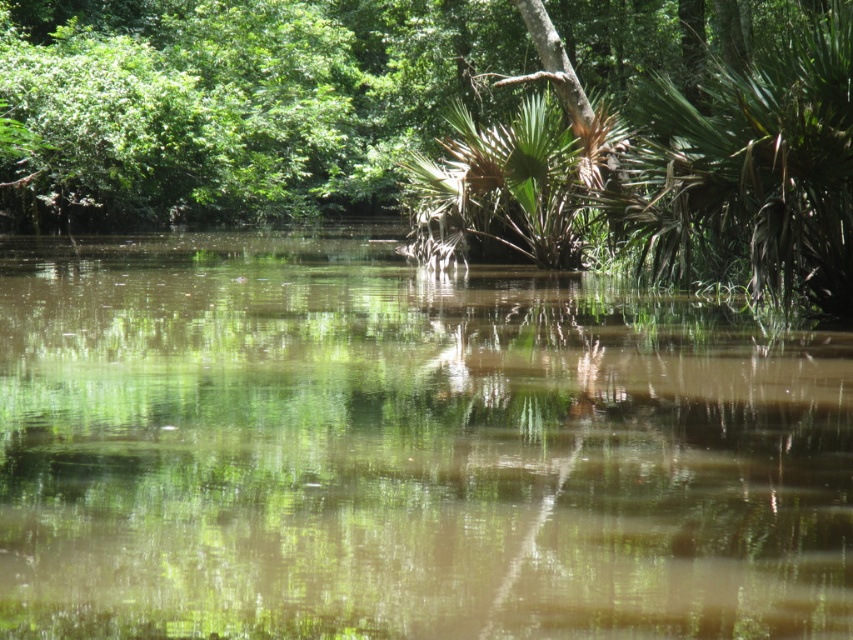
Question: Observing the image, what is the correct spatial positioning of green reflective water at center in reference to green leafy tree at upper center?

Choices:
 (A) right
 (B) left

Answer: (A)

Question: Is green reflective water at center to the left of green leafy tree at upper center from the viewer's perspective?

Choices:
 (A) yes
 (B) no

Answer: (B)

Question: Which point is closer to the camera?

Choices:
 (A) green leafy tree at upper center
 (B) green reflective water at center

Answer: (B)

Question: Does green reflective water at center lie in front of green leafy tree at upper center?

Choices:
 (A) no
 (B) yes

Answer: (B)